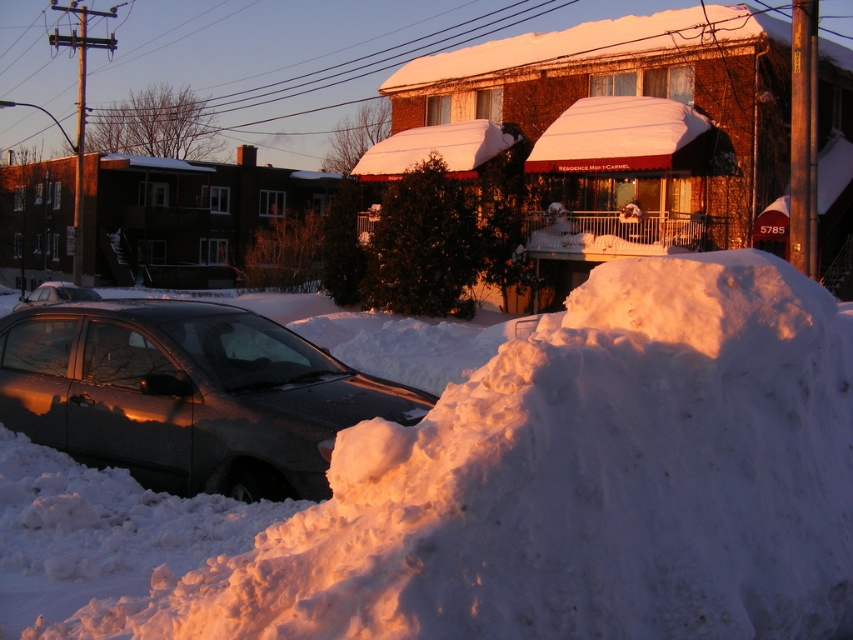
Based on the photo, does white fluffy snow at lower left have a lesser width compared to satin black car at lower left?

In fact, white fluffy snow at lower left might be wider than satin black car at lower left.

Does point (27, 621) come in front of point (151, 424)?

Yes, it is in front of point (151, 424).

Is point (527, 420) behind point (358, 413)?

No, it is not.

The image size is (853, 640). I want to click on white fluffy snow at lower left, so click(576, 484).

Which of these two, white fluffy snow at lower left or shiny black car at left, stands shorter?

Standing shorter between the two is shiny black car at left.

Can you confirm if white fluffy snow at lower left is positioned to the right of shiny black car at left?

Indeed, white fluffy snow at lower left is positioned on the right side of shiny black car at left.

Is point (491, 625) closer to camera compared to point (57, 300)?

Yes, point (491, 625) is closer to viewer.

Locate an element on the screen. Image resolution: width=853 pixels, height=640 pixels. white fluffy snow at lower left is located at coordinates (576, 484).

Does satin black car at lower left come behind shiny black car at left?

No, satin black car at lower left is in front of shiny black car at left.

Which is more to the right, satin black car at lower left or shiny black car at left?

satin black car at lower left is more to the right.

Identify the location of satin black car at lower left. (187, 394).